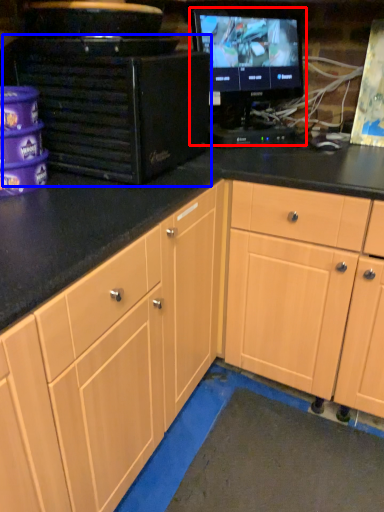
Question: Which object is further to the camera taking this photo, computer monitor (highlighted by a red box) or desktop computer (highlighted by a blue box)?

Choices:
 (A) computer monitor
 (B) desktop computer

Answer: (A)